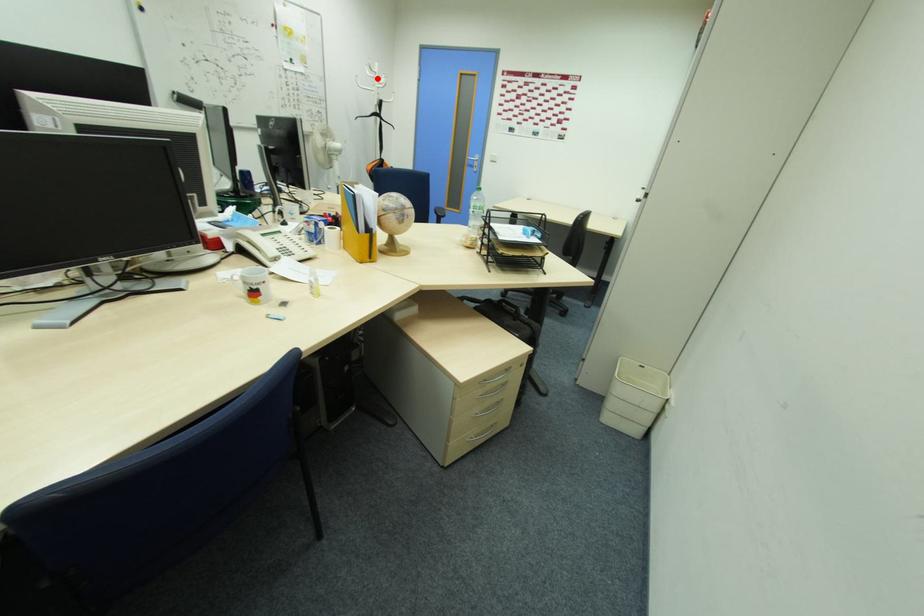
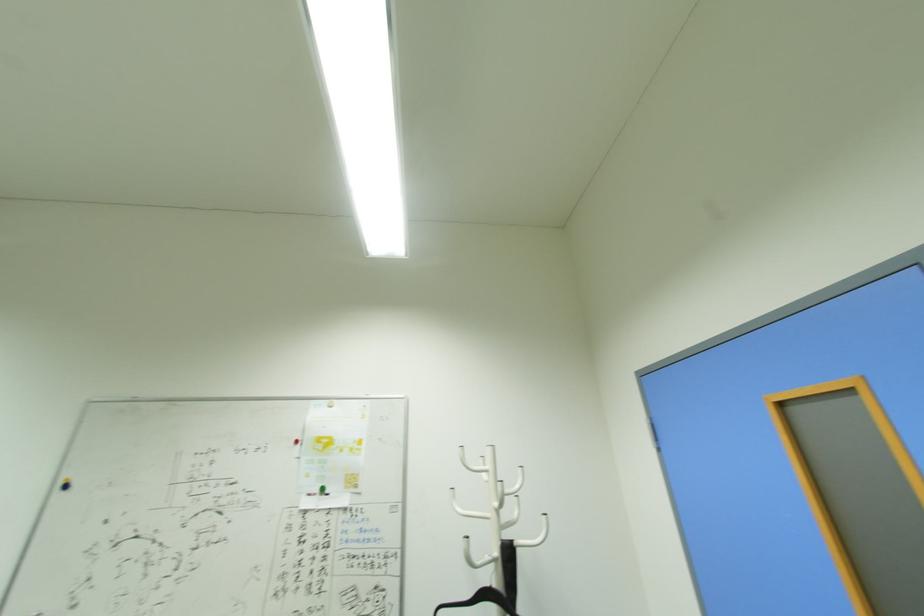
Question: A red point is marked in image1. In image2, is the corresponding 3D point closer to the camera or farther? Reply with the corresponding letter.

Choices:
 (A) The corresponding 3D point is closer.
 (B) The corresponding 3D point is farther.

Answer: (B)